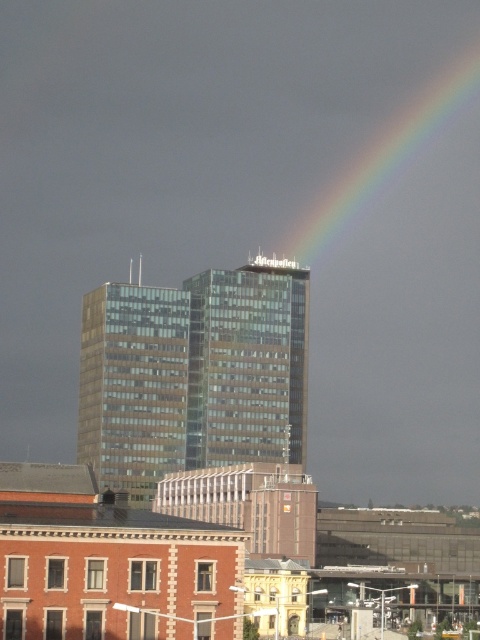
Question: Does transparent glass building at center have a smaller size compared to rainbow at upper right?

Choices:
 (A) yes
 (B) no

Answer: (A)

Question: Does transparent glass building at center have a lesser width compared to rainbow at upper right?

Choices:
 (A) no
 (B) yes

Answer: (B)

Question: Among these objects, which one is nearest to the camera?

Choices:
 (A) rainbow at upper right
 (B) transparent glass building at center

Answer: (B)

Question: Among these points, which one is nearest to the camera?

Choices:
 (A) coord(349,198)
 (B) coord(133,445)

Answer: (B)

Question: Does transparent glass building at center appear under rainbow at upper right?

Choices:
 (A) yes
 (B) no

Answer: (A)